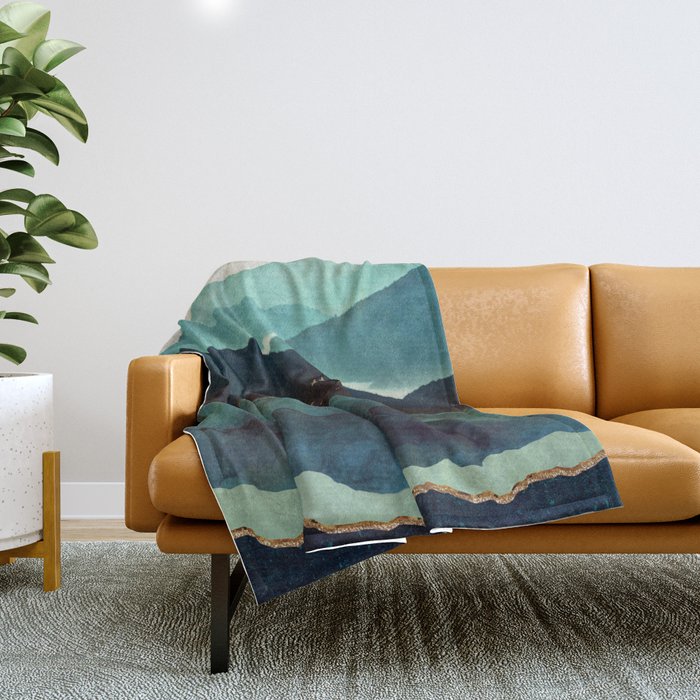
I want to click on wall, so click(428, 76).